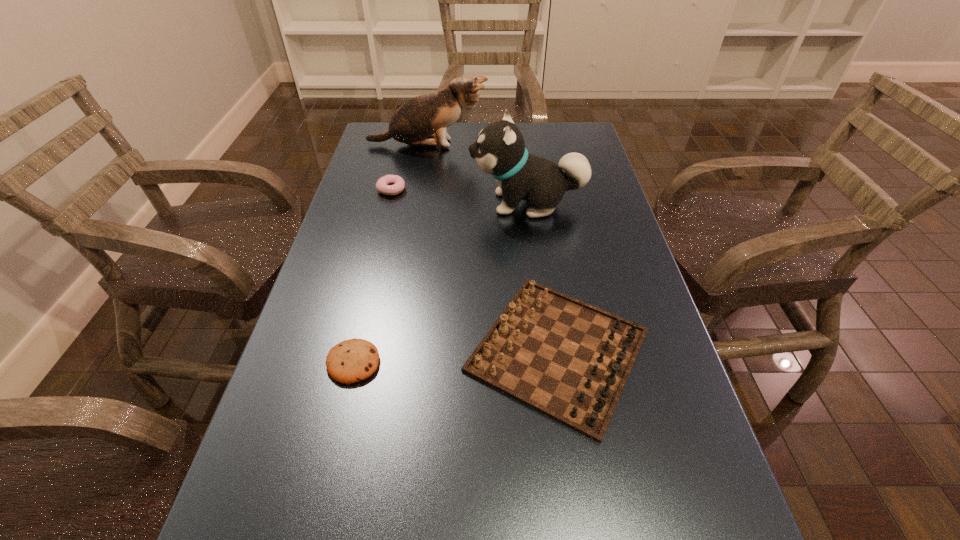
You are a GUI agent. You are given a task and a screenshot of the screen. Output one action in this format:
    pyautogui.click(x=<x>, y=<y>)
    Task: Click on the vacant region located 0.260m on the front of the doughnut
    The width and height of the screenshot is (960, 540).
    Given the screenshot: What is the action you would take?
    pyautogui.click(x=373, y=262)

The image size is (960, 540). Find the location of `free space located 0.120m on the right of the shortest object`. free space located 0.120m on the right of the shortest object is located at coordinates (443, 362).

Identify the location of object situated at the far edge. (415, 122).

Locate an element on the screen. This screenshot has height=540, width=960. cat located at the left edge is located at coordinates (415, 122).

I want to click on doughnut present at the left edge, so pos(389,184).

Where is `cookie at the left edge`? cookie at the left edge is located at coordinates (353, 360).

The width and height of the screenshot is (960, 540). Find the location of `puppy at the right edge`. puppy at the right edge is located at coordinates (499, 150).

I want to click on chessboard that is at the right edge, so click(x=567, y=359).

Locate an element on the screen. The image size is (960, 540). object that is at the far left corner is located at coordinates (415, 122).

The width and height of the screenshot is (960, 540). In order to click on free region at the far edge of the desktop in this screenshot , I will do `click(528, 137)`.